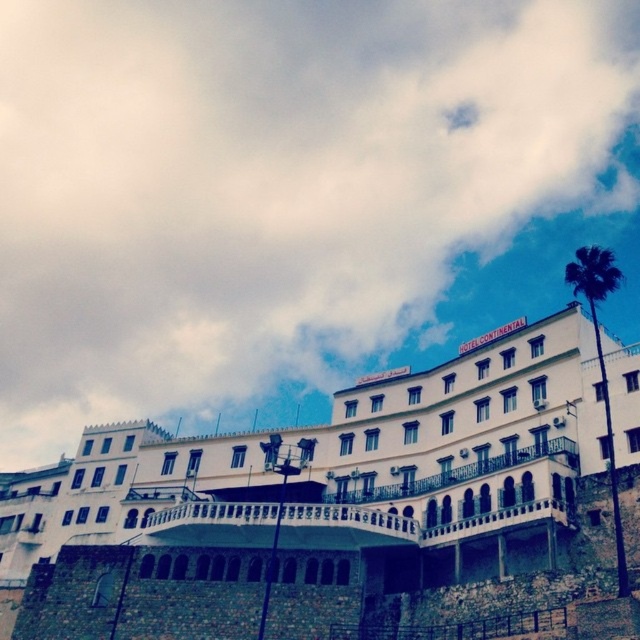
Who is positioned more to the left, white stone building at center or green leafy palm at upper right?

white stone building at center is more to the left.

Does white stone building at center have a smaller size compared to green leafy palm at upper right?

Correct, white stone building at center occupies less space than green leafy palm at upper right.

Where is `white stone building at center`? The image size is (640, 640). white stone building at center is located at coordinates (330, 508).